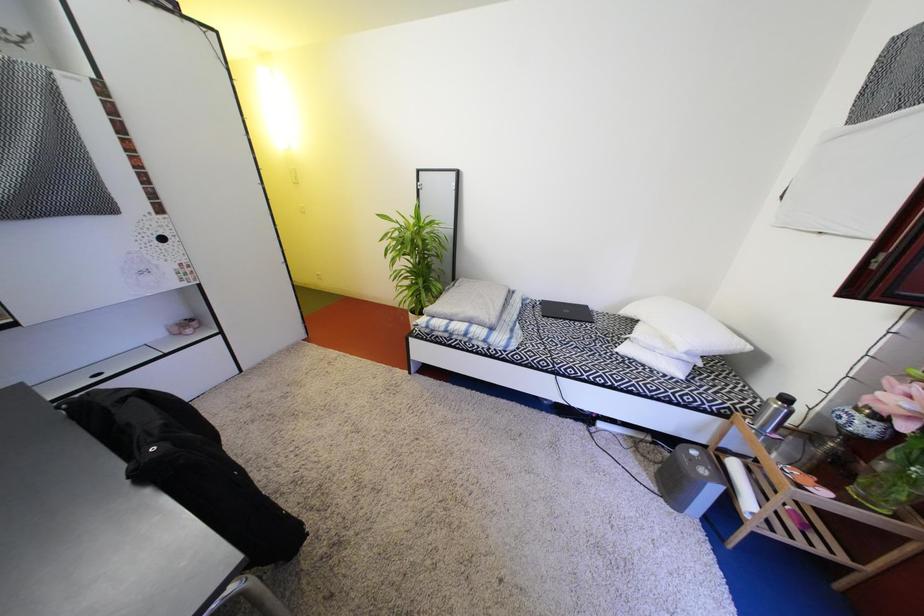
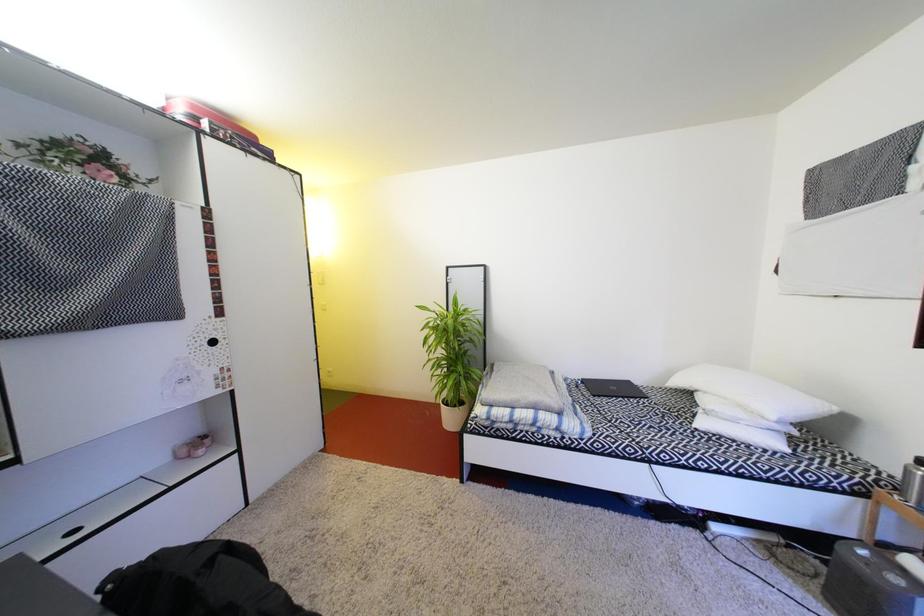
Question: The images are taken continuously from a first-person perspective. In which direction are you moving?

Choices:
 (A) Left
 (B) Right
 (C) Forward
 (D) Backward

Answer: (A)